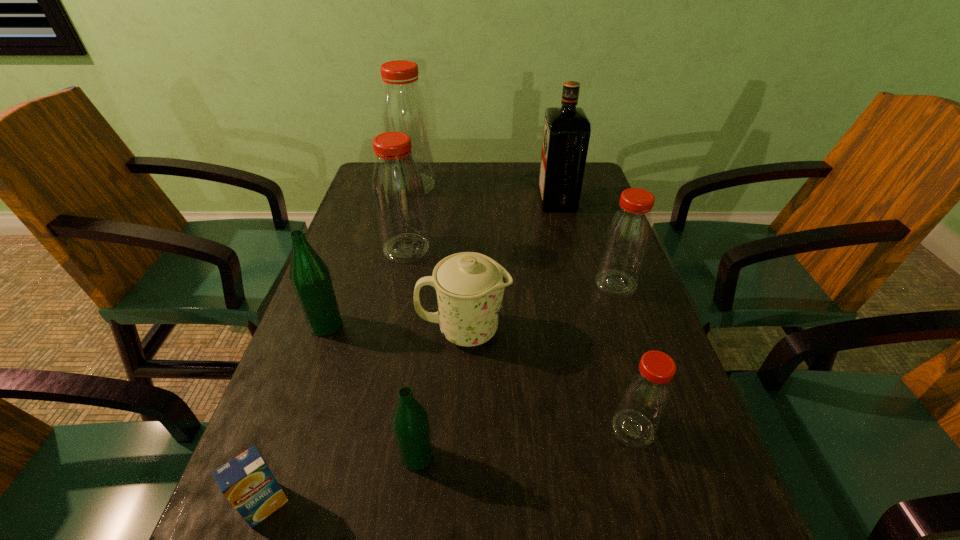
You are a GUI agent. You are given a task and a screenshot of the screen. Output one action in this format:
    pyautogui.click(x=<x>, y=<y>)
    Task: Click on the nearest red bottle
    This screenshot has width=960, height=540.
    Given the screenshot: What is the action you would take?
    point(647,392)

Find the location of a particular element. the right green bottle is located at coordinates (410, 422).

Where is `the nearer green bottle`? This screenshot has height=540, width=960. the nearer green bottle is located at coordinates (410, 422).

Identify the location of the shortest object. Image resolution: width=960 pixels, height=540 pixels. (246, 481).

Locate an element on the screen. Image resolution: width=960 pixels, height=540 pixels. the nearest object is located at coordinates coord(246,481).

The height and width of the screenshot is (540, 960). Identify the location of vacant position located on the right of the biggest red bottle. (527, 185).

Identify the location of free spot located 0.110m on the front label of the liquor. (503, 200).

You are a GUI agent. You are given a task and a screenshot of the screen. Output one action in this format:
    pyautogui.click(x=<x>, y=<y>)
    Task: Click on the free space located 0.130m on the front label of the liquor
    The height and width of the screenshot is (540, 960).
    Given the screenshot: What is the action you would take?
    pyautogui.click(x=496, y=200)

The height and width of the screenshot is (540, 960). Identify the location of vacant area situated 0.180m on the front label of the liquor. (480, 200).

Find the location of `vacant space situated 0.350m on the right of the third farthest object`. vacant space situated 0.350m on the right of the third farthest object is located at coordinates (564, 248).